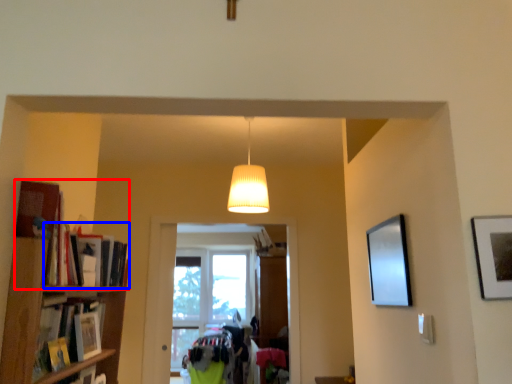
Question: Among these objects, which one is farthest to the camera, book (highlighted by a red box) or book (highlighted by a blue box)?

Choices:
 (A) book
 (B) book

Answer: (B)